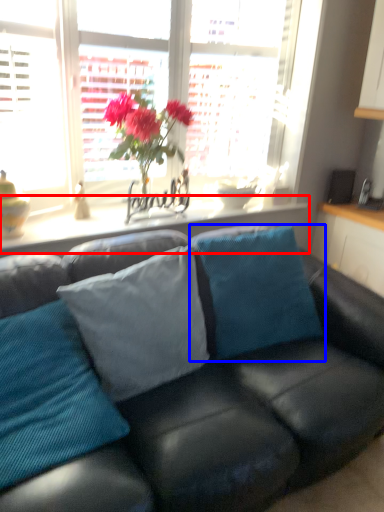
Question: Which point is further to the camera, window sill (highlighted by a red box) or pillow (highlighted by a blue box)?

Choices:
 (A) window sill
 (B) pillow

Answer: (A)